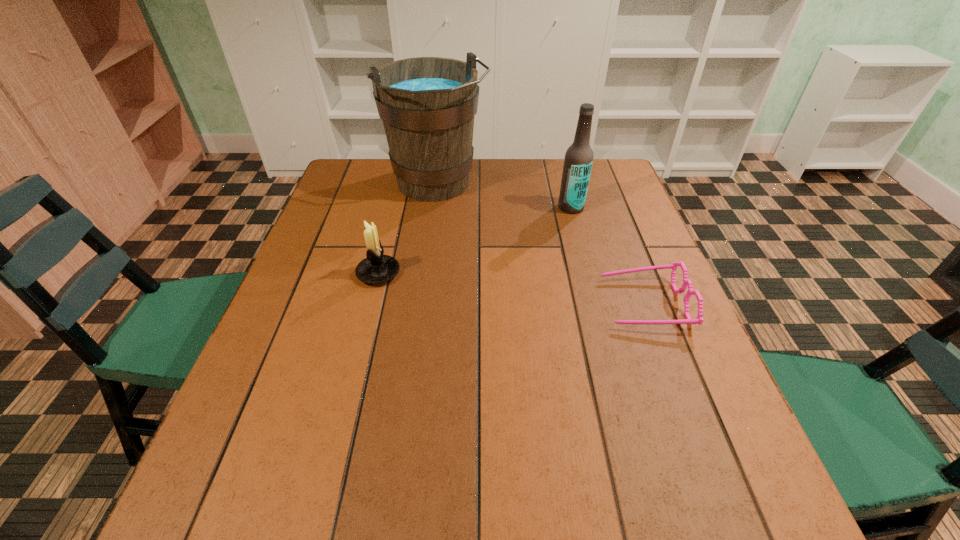
This screenshot has height=540, width=960. I want to click on free space at the far edge of the desktop, so click(490, 166).

Locate an element on the screen. This screenshot has height=540, width=960. free region at the near edge is located at coordinates (415, 451).

Find the location of `vacant space at the left edge`. vacant space at the left edge is located at coordinates (247, 386).

The image size is (960, 540). Identify the location of vacant region at the right edge of the desktop. (631, 251).

Where is `vacant space at the far right corner of the desktop`? vacant space at the far right corner of the desktop is located at coordinates (591, 183).

Locate an element on the screen. vacant area at the near right corner of the desktop is located at coordinates (698, 447).

Find the location of a particular element. This screenshot has width=960, height=540. vacant point located between the tallest object and the candle holder is located at coordinates (408, 229).

Locate an element on the screen. free space between the candle holder and the beer bottle is located at coordinates (474, 240).

The height and width of the screenshot is (540, 960). In order to click on free point between the second tallest object and the shortest object in this screenshot , I will do `click(608, 255)`.

The height and width of the screenshot is (540, 960). Find the location of `vacant space that is in between the third shortest object and the spectacles`. vacant space that is in between the third shortest object and the spectacles is located at coordinates (608, 255).